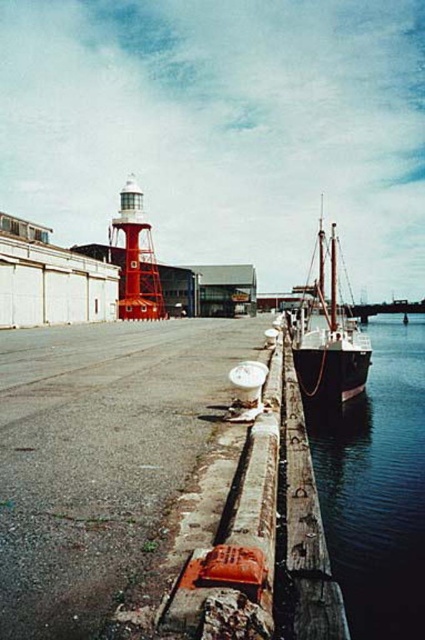
You are standing at the edge of the dock and want to place a small potted plant between the two points marked as point (x=399, y=332) and point (x=323, y=346). Since the potted plant needs to be closer to you, which point should you use as the reference for placement?

Point (x=399, y=332) is further to the viewer than point (x=323, y=346). To place the potted plant closer to you, you should use point (x=399, y=332) as the reference because it is nearer to your position at the dock edge.

You are a photographer planning to capture a wide shot of the wooden ship at right and the dark blue water at lower right. Considering their sizes in the frame, which one should you focus on to ensure it fills more of the photo?

The wooden ship at right should be focused on because it is larger than the dark blue water at lower right in the frame.

You are standing on the dock and want to reach the wooden ship at right. Which direction should you walk to get closer to it from the dark blue water at lower right?

The dark blue water at lower right is to the left of the wooden ship at right, so you should walk to the right to get closer to the wooden ship at right.